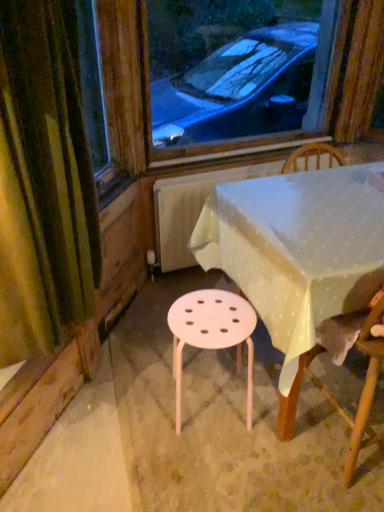
I want to click on vacant space to the left of pink plastic stool at center, so click(x=136, y=402).